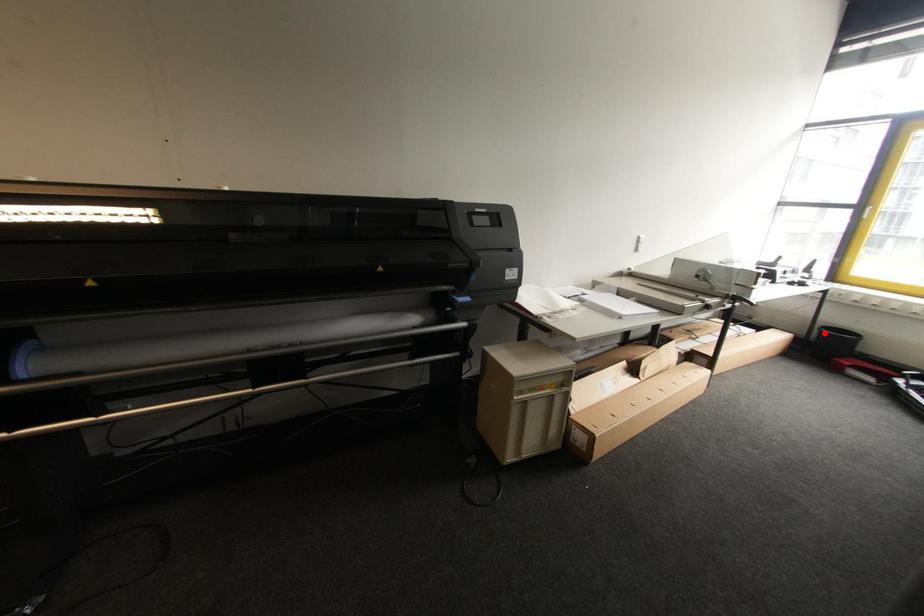
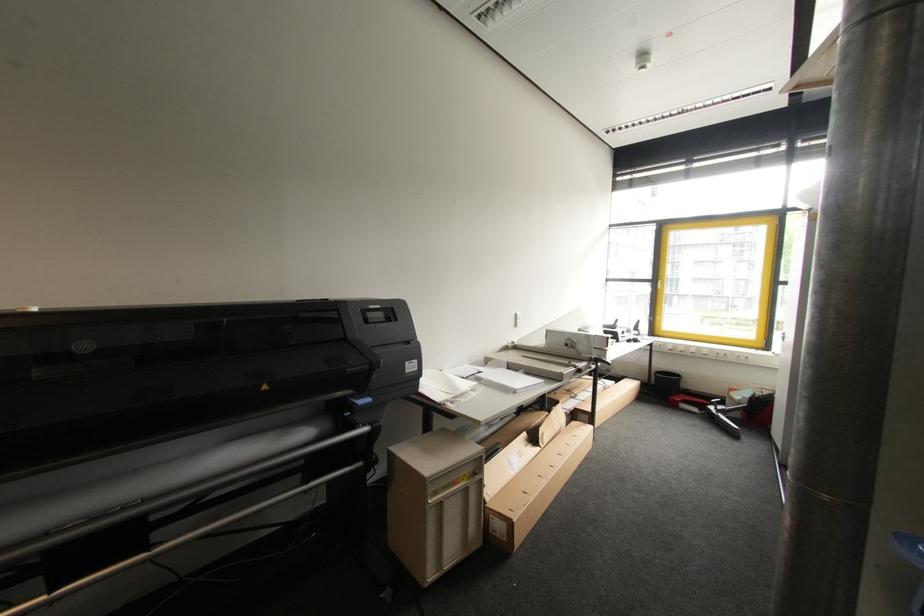
Where in the second image is the point corresponding to the highlighted location from the first image?

(660, 378)